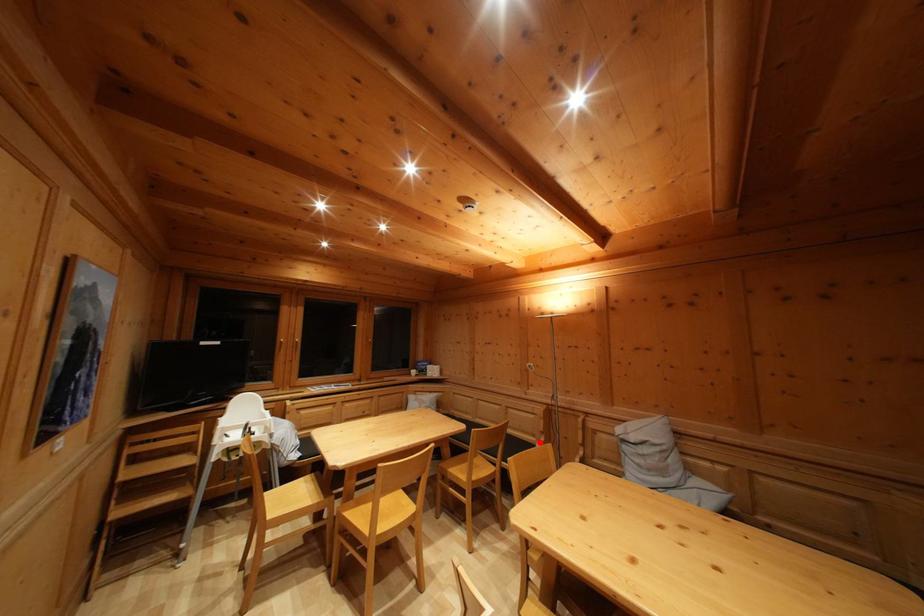
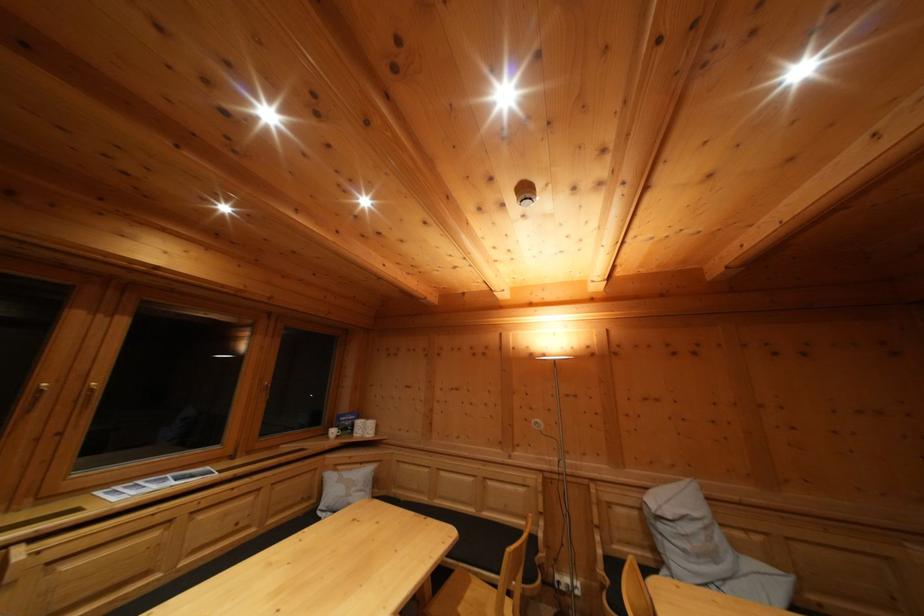
Find the pixel in the second image that matches the highlighted location in the first image.

(532, 525)